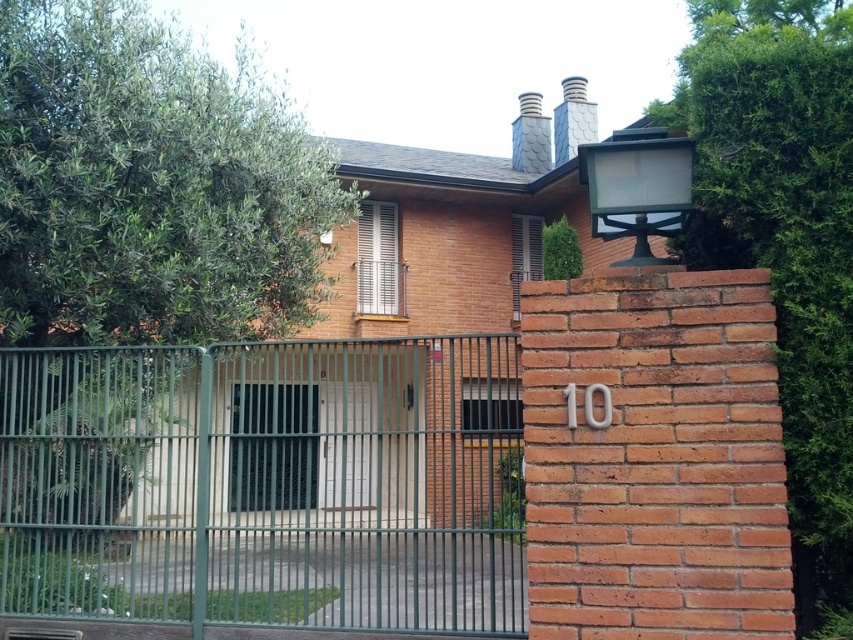
Is point (805, 97) positioned after point (318, 472)?

No, it is not.

Between point (815, 408) and point (341, 397), which one is positioned in front?

Point (815, 408)

This screenshot has height=640, width=853. Identify the location of green leafy tree at right. pyautogui.click(x=784, y=243).

Does green metal fence at center lie in front of green leafy tree at right?

No.

Which is behind, point (479, 449) or point (833, 592)?

Point (479, 449)

Where is `green metal fence at center`? green metal fence at center is located at coordinates (262, 484).

Where is `green metal fence at center`? Image resolution: width=853 pixels, height=640 pixels. green metal fence at center is located at coordinates (262, 484).

Which is more to the right, green metal fence at center or white glossy door at center?

white glossy door at center is more to the right.

Can you confirm if green metal fence at center is positioned below white glossy door at center?

Correct, green metal fence at center is located below white glossy door at center.

Which is behind, point (368, 346) or point (341, 493)?

Positioned behind is point (341, 493).

This screenshot has width=853, height=640. Identify the location of green metal fence at center. (262, 484).